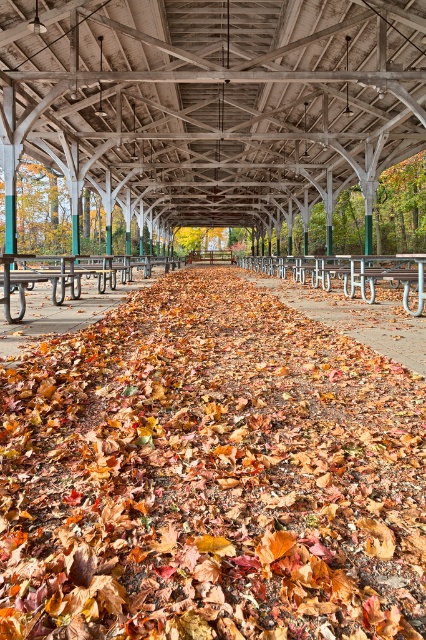
Question: Is brown leafy path at center thinner than metallic silver bench at center?

Choices:
 (A) yes
 (B) no

Answer: (A)

Question: Does metallic silver bench at center appear on the left side of wooden picnic table at center?

Choices:
 (A) yes
 (B) no

Answer: (B)

Question: Does brown leafy path at center have a greater width compared to wooden picnic table at center?

Choices:
 (A) yes
 (B) no

Answer: (A)

Question: Which of the following is the farthest from the observer?

Choices:
 (A) (391, 269)
 (B) (356, 333)

Answer: (A)

Question: Which of the following is the closest to the observer?

Choices:
 (A) metallic silver bench at center
 (B) brown leafy path at center
 (C) wooden picnic table at center
 (D) wooden beams at center

Answer: (B)

Question: Which object is the closest to the brown leafy path at center?

Choices:
 (A) wooden picnic table at center
 (B) wooden beams at center

Answer: (A)